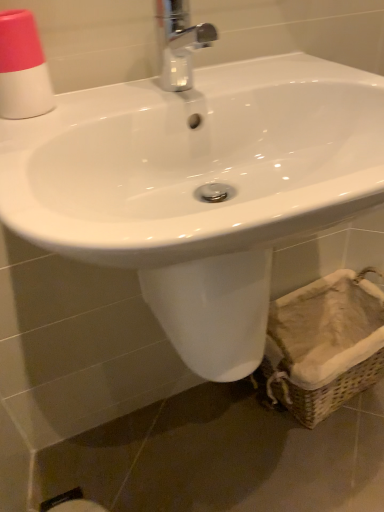
What are the coordinates of `free space to the right of pink matte cup at upper left` in the screenshot? It's located at (119, 98).